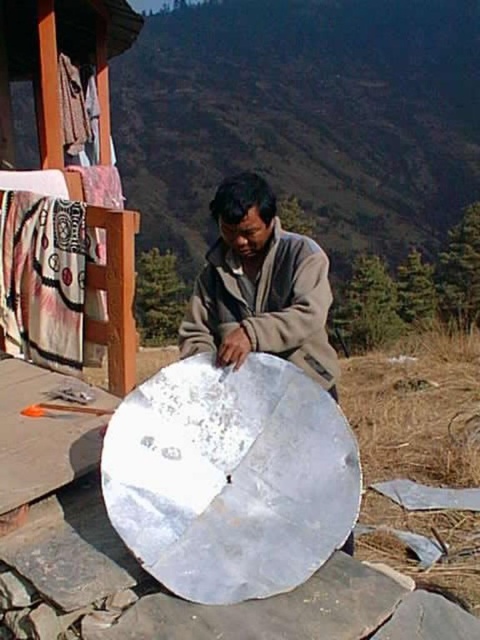
Does matte gray jacket at center come in front of white woven cloth at upper left?

Yes, it is.

Can you confirm if matte gray jacket at center is bigger than white woven cloth at upper left?

Yes.

Is point (216, 342) more distant than point (80, 276)?

No, (216, 342) is in front of (80, 276).

I want to click on matte gray jacket at center, so click(260, 285).